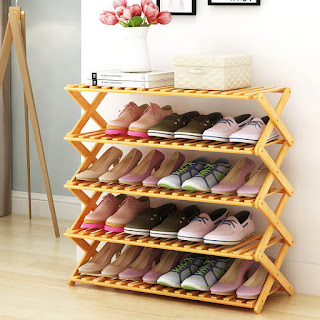
Identify the location of shelves with shoes on them. (153, 290), (155, 245), (155, 193), (157, 145).